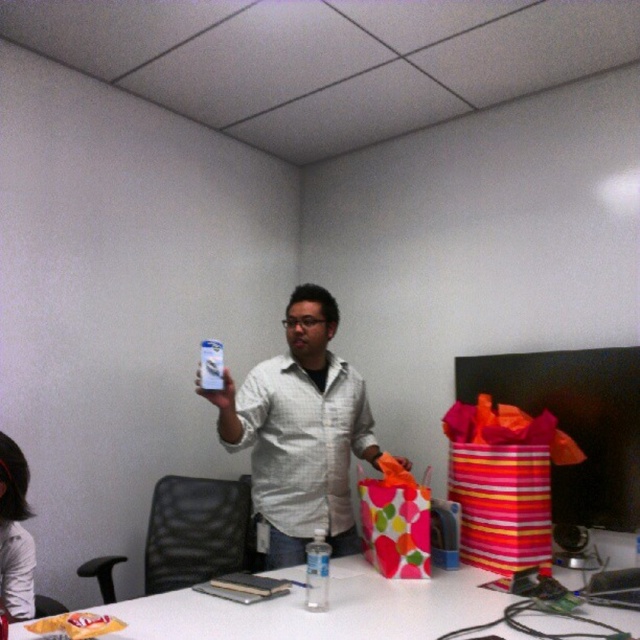
Is white glossy table at center closer to camera compared to clear plastic bottle at center?

Yes.

Which is more to the left, white glossy table at center or clear plastic bottle at center?

clear plastic bottle at center

Identify the location of white glossy table at center. Image resolution: width=640 pixels, height=640 pixels. (321, 612).

Is white glossy can at center to the left of white glossy table at center from the viewer's perspective?

Correct, you'll find white glossy can at center to the left of white glossy table at center.

Is point (268, 406) positioned after point (547, 627)?

Yes, point (268, 406) is farther from viewer.

The width and height of the screenshot is (640, 640). Find the location of `white glossy can at center`. white glossy can at center is located at coordinates (301, 433).

Is point (340, 518) positioned before point (228, 396)?

No.

Is white glossy can at center below matte plastic bottle at upper center?

Yes.

Is point (310, 442) behind point (234, 388)?

Yes, it is behind point (234, 388).

The height and width of the screenshot is (640, 640). I want to click on white glossy can at center, so click(301, 433).